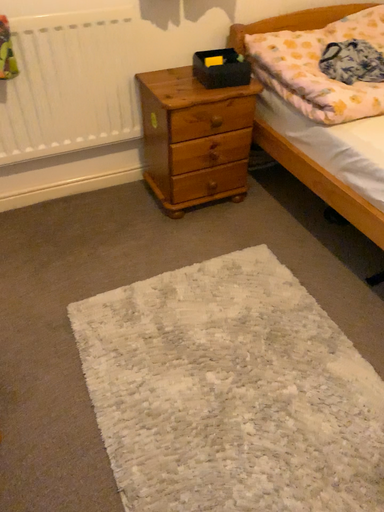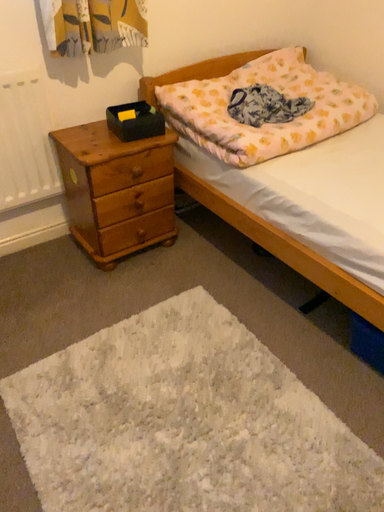
Question: How did the camera likely rotate when shooting the video?

Choices:
 (A) rotated right
 (B) rotated left

Answer: (A)